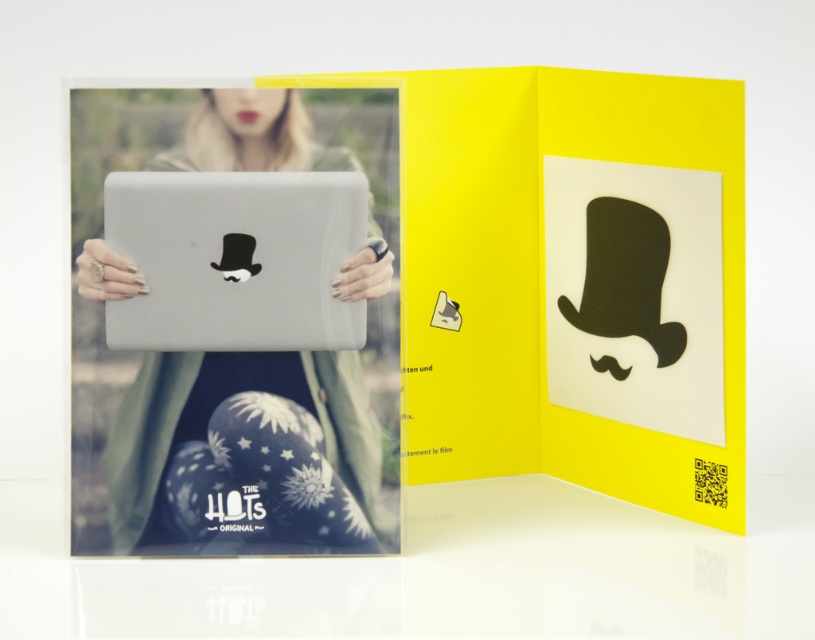
You are looking at the promotional folder and want to determine which of the two points, point (263, 506) or point (205, 184), is closer to the camera. Based on the description, which point is closer?

Point (263, 506) is further to the camera than point (205, 184), so point (205, 184) is closer to the camera.

Looking at the promotional folder, you notice the blonde hair at center and the satin silver laptop at center. Which object appears taller in the image?

The blonde hair at center is much taller as the satin silver laptop at center.

Looking at the promotional folder, which object is positioned to the right of the other between the blonde hair at center and the satin silver laptop at center?

The blonde hair at center is to the right of the satin silver laptop at center.